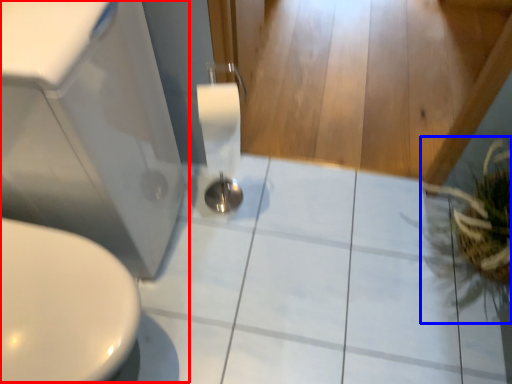
Question: Which point is further to the camera, sink (highlighted by a red box) or plant (highlighted by a blue box)?

Choices:
 (A) sink
 (B) plant

Answer: (B)